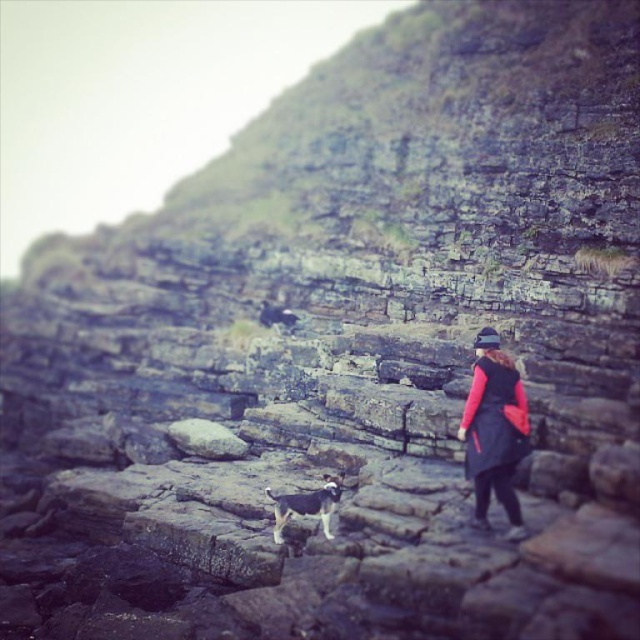
Question: Is dark red fabric jacket at right smaller than brown and white fur dog at center?

Choices:
 (A) yes
 (B) no

Answer: (B)

Question: Which point is closer to the camera?

Choices:
 (A) (516, 534)
 (B) (269, 490)

Answer: (A)

Question: Is the position of dark red fabric jacket at right more distant than that of brown and white fur dog at center?

Choices:
 (A) yes
 (B) no

Answer: (B)

Question: Which object appears closest to the camera in this image?

Choices:
 (A) brown and white fur dog at center
 (B) dark red fabric jacket at right

Answer: (B)

Question: Is dark red fabric jacket at right bigger than brown and white fur dog at center?

Choices:
 (A) no
 (B) yes

Answer: (B)